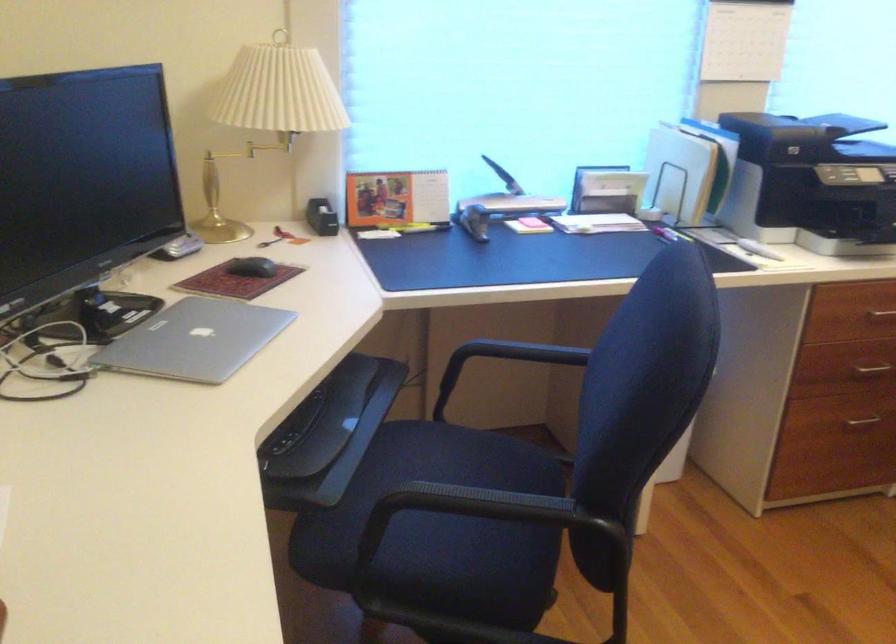
What do you see at coordinates (458, 511) in the screenshot? The image size is (896, 644). I see `a chair sitting surface` at bounding box center [458, 511].